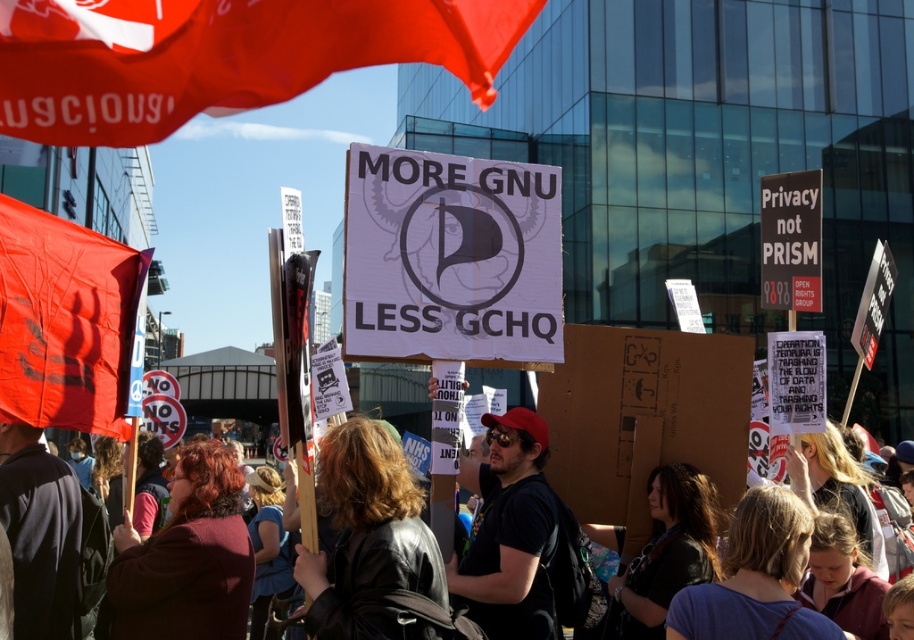
You are a photographer trying to capture a photo of the protest scene. You want to ensure both the dark brown leather jacket at lower left and the blonde hair at center are visible in the frame. Based on their positions, which object should you prioritize framing first to ensure both are in the shot?

The dark brown leather jacket at lower left is positioned on the left side of blonde hair at center. To ensure both are in the frame, prioritize framing the dark brown leather jacket at lower left first, as it is further to the left and closer to the edge of the potential frame, allowing the blonde hair at center to be included to its right.

In the scene shown: You are a photographer trying to capture a closeup of the dark brown leather jacket at lower left and the blonde hair at center. Which object should you zoom in on first to ensure both are in frame without moving the camera?

Since the dark brown leather jacket at lower left occupies less space than blonde hair at center, you should zoom in on the dark brown leather jacket at lower left first to ensure both are in frame without moving the camera.